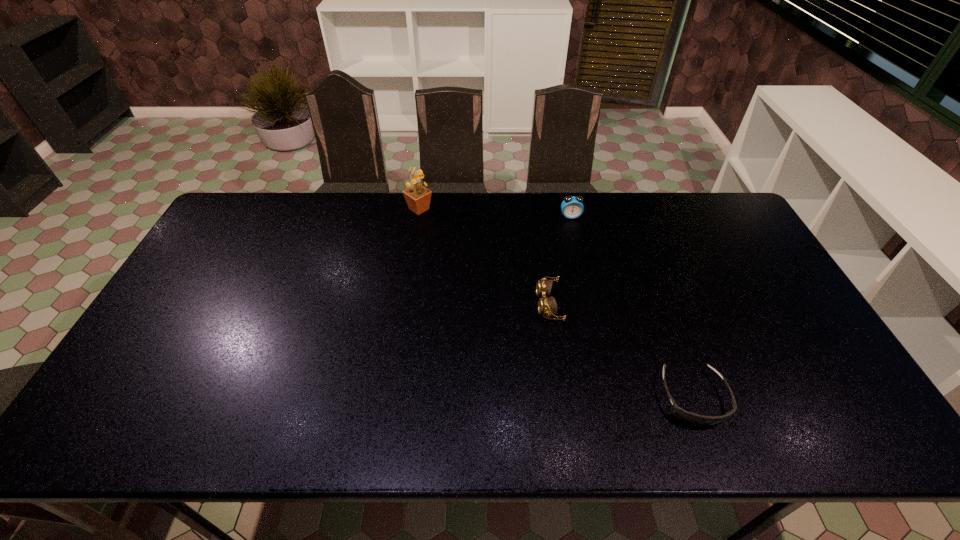
The image size is (960, 540). I want to click on vacant space at the far right corner of the desktop, so click(x=719, y=208).

Where is `unoccupied area between the left goggles and the leftmost object`? unoccupied area between the left goggles and the leftmost object is located at coordinates (484, 257).

Find the location of a particular element. Image resolution: width=960 pixels, height=540 pixels. free space between the tallest object and the farther goggles is located at coordinates (484, 257).

The width and height of the screenshot is (960, 540). I want to click on free space between the alarm clock and the nearest object, so click(x=632, y=307).

At what (x,y) coordinates should I click in order to perform the action: click on vacant space that's between the tallest object and the third farthest object. Please return your answer as a coordinate pair (x, y). The image size is (960, 540). Looking at the image, I should click on (484, 257).

You are a GUI agent. You are given a task and a screenshot of the screen. Output one action in this format:
    pyautogui.click(x=<x>, y=<y>)
    Task: Click on the free space between the leftmost object and the second object from right to left
    This screenshot has width=960, height=540.
    Given the screenshot: What is the action you would take?
    pyautogui.click(x=495, y=213)

Find the location of a particular element. vacant space that's between the third object from right to left and the sunflower is located at coordinates (484, 257).

Locate an element on the screen. This screenshot has width=960, height=540. vacant space in between the alarm clock and the third object from right to left is located at coordinates (560, 260).

Image resolution: width=960 pixels, height=540 pixels. I want to click on free point between the second object from right to left and the leftmost object, so click(495, 213).

This screenshot has height=540, width=960. I want to click on object that can be found as the closest to the second nearest object, so click(x=695, y=419).